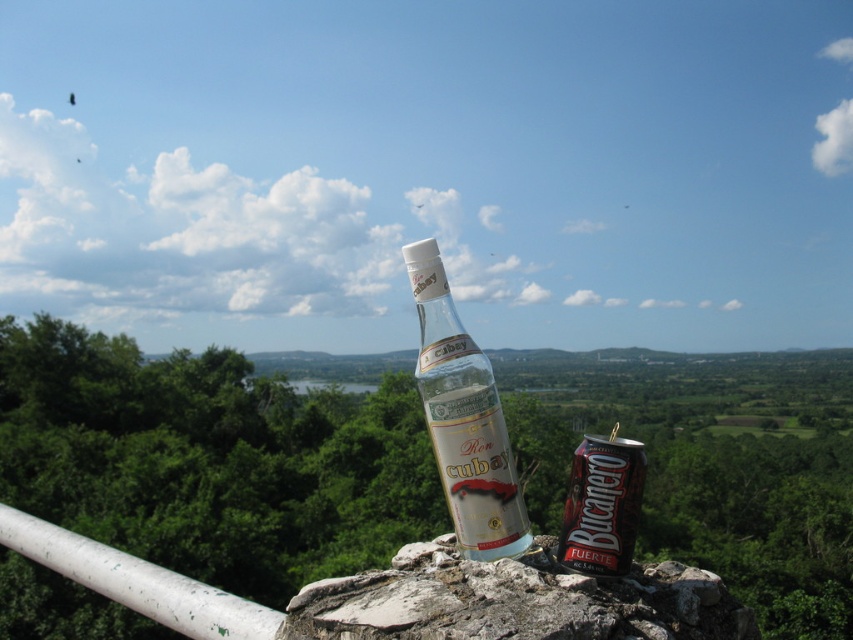
Question: Is clear glass bottle at center further to camera compared to metallic silver can at center?

Choices:
 (A) no
 (B) yes

Answer: (B)

Question: Which of the following is the closest to the observer?

Choices:
 (A) clear glass bottle at center
 (B) metallic silver can at center

Answer: (B)

Question: Which point is farther to the camera?

Choices:
 (A) (448, 413)
 (B) (624, 529)

Answer: (A)

Question: Does clear glass bottle at center have a greater width compared to metallic silver can at center?

Choices:
 (A) yes
 (B) no

Answer: (A)

Question: Is clear glass bottle at center in front of metallic silver can at center?

Choices:
 (A) yes
 (B) no

Answer: (B)